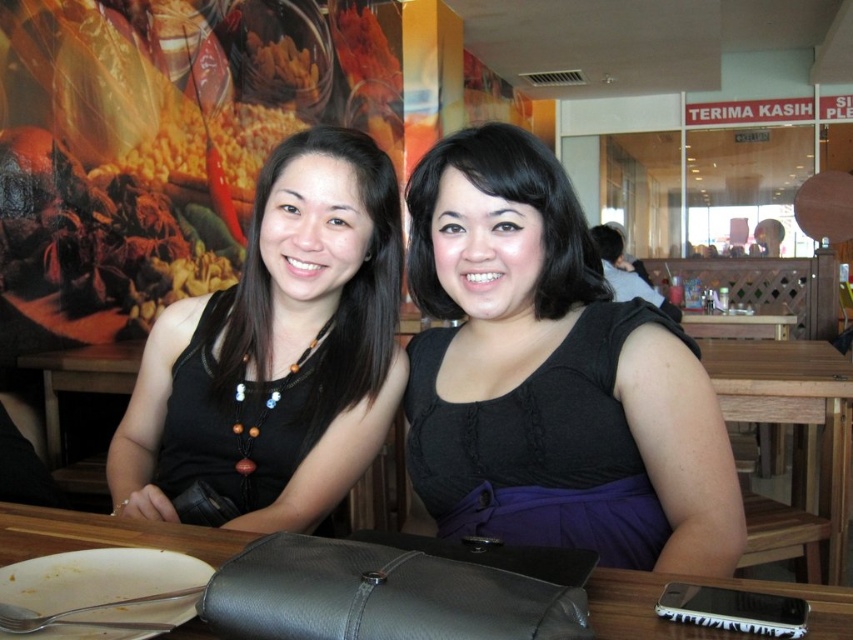
You are a photographer trying to capture a photo of the black matte dress at center and the yellow popcorn at upper left. Which object should you focus on first if you want to ensure both are in focus without adjusting the camera settings?

The black matte dress at center is much taller than the yellow popcorn at upper left, so focusing on the black matte dress at center first will help ensure both are in focus since it is farther away and requires a deeper depth of field.

Looking at this image, you are a photographer setting up for a group photo. You have a camera with a 1.5 meter focal length lens. The black matte dress at center and the yellow popcorn at upper left are in your frame. Considering their sizes, which object will appear larger in the photo?

The yellow popcorn at upper left will appear larger in the photo because the black matte dress at center has a smaller size compared to yellow popcorn at upper left.